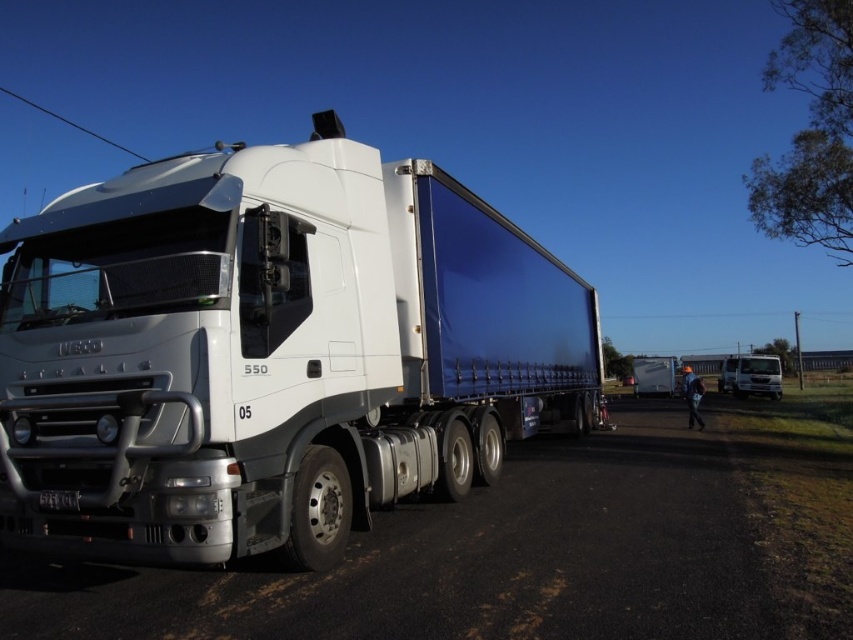
Can you confirm if white glossy trailer truck at center is smaller than matte blue trailer at center?

Correct, white glossy trailer truck at center occupies less space than matte blue trailer at center.

Is white glossy trailer truck at center above matte blue trailer at center?

Yes.

This screenshot has width=853, height=640. Identify the location of white glossy trailer truck at center. (271, 353).

I want to click on white glossy trailer truck at center, so click(271, 353).

Between point (720, 371) and point (646, 371), which one is positioned in front?

Positioned in front is point (646, 371).

The height and width of the screenshot is (640, 853). What do you see at coordinates (751, 376) in the screenshot?
I see `white matte truck at right` at bounding box center [751, 376].

What are the coordinates of `white matte truck at right` in the screenshot? It's located at (751, 376).

Is point (50, 477) positioned behind point (759, 356)?

That is False.

Locate an element on the screen. white glossy trailer truck at center is located at coordinates (271, 353).